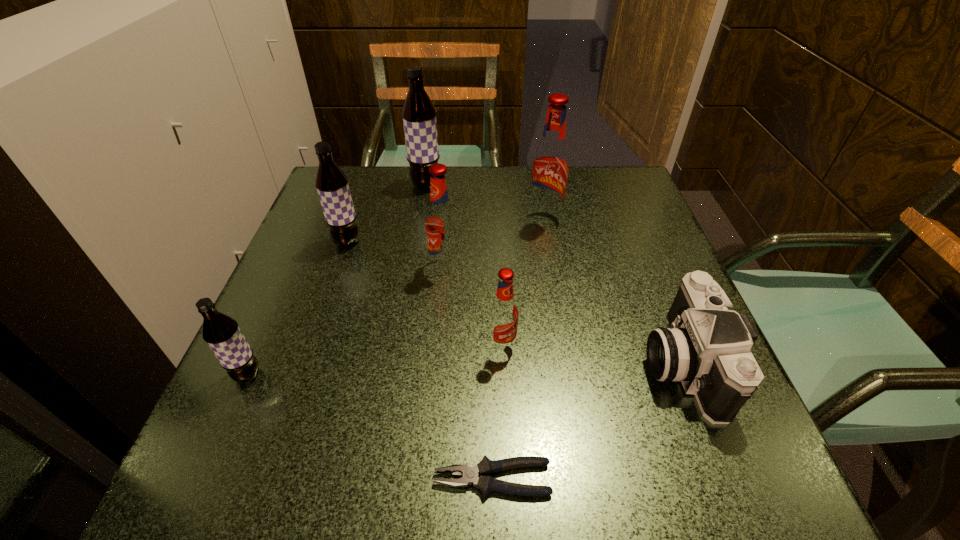
Locate an element on the screen. The image size is (960, 540). vacant point located 0.390m on the left of the nearest red root beer is located at coordinates (272, 345).

This screenshot has width=960, height=540. What are the coordinates of `vacant region located on the right of the nearest root beer` in the screenshot? It's located at (374, 375).

Find the location of `free region located 0.070m on the left of the camera`. free region located 0.070m on the left of the camera is located at coordinates (604, 362).

At what (x,y) coordinates should I click in order to perform the action: click on vacant space located 0.250m at the gripping part of the shortest object. Please return your answer as a coordinate pair (x, y). The height and width of the screenshot is (540, 960). Looking at the image, I should click on (257, 478).

Image resolution: width=960 pixels, height=540 pixels. In order to click on free spot located at the gripping part of the shortest object in this screenshot , I will do `click(251, 478)`.

Locate an element on the screen. Image resolution: width=960 pixels, height=540 pixels. blank space located 0.060m at the gripping part of the shortest object is located at coordinates (392, 478).

Identify the location of object located in the near edge section of the desktop. (486, 484).

You are a GUI agent. You are given a task and a screenshot of the screen. Output one action in this format:
    pyautogui.click(x=<x>, y=<y>)
    Task: Click on the object present at the right edge
    
    Given the screenshot: What is the action you would take?
    pyautogui.click(x=707, y=347)

At what (x,y) coordinates should I click in order to perform the action: click on blank area at the far edge. Please return your answer as a coordinate pair (x, y). This screenshot has width=960, height=540. Looking at the image, I should click on (519, 208).

I want to click on free location at the left edge of the desktop, so click(268, 380).